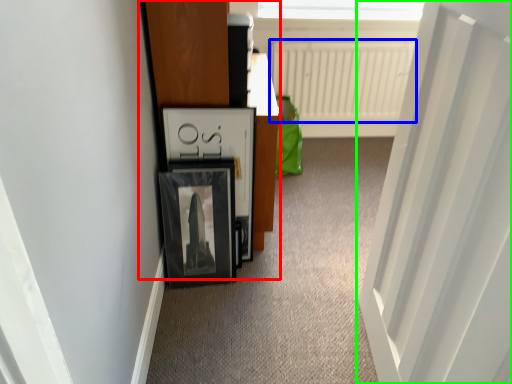
Question: Which is farther away from dresser (highlighted by a red box)? radiator (highlighted by a blue box) or door (highlighted by a green box)?

Choices:
 (A) radiator
 (B) door

Answer: (A)